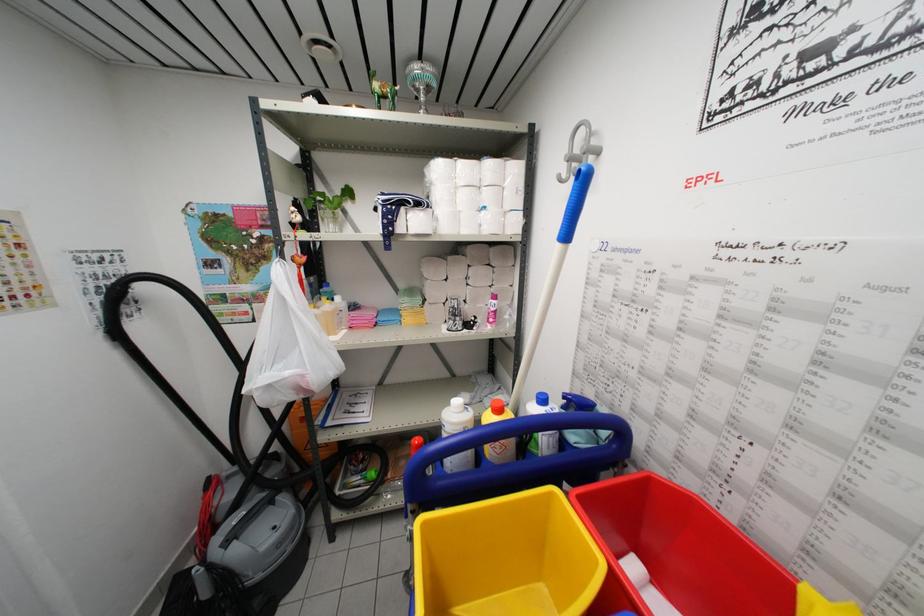
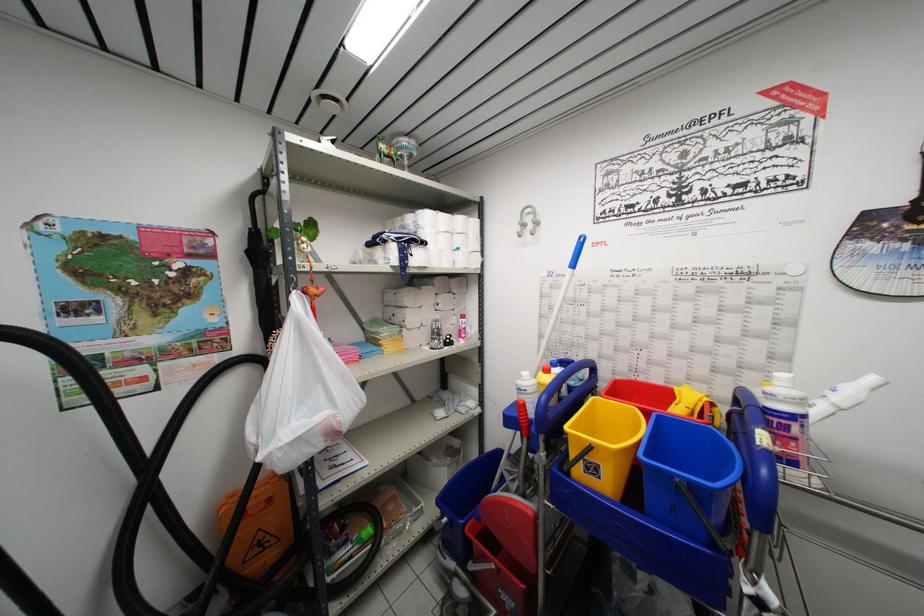
Where in the second image is the point corresponding to pixel 593 139 from the first image?

(537, 217)